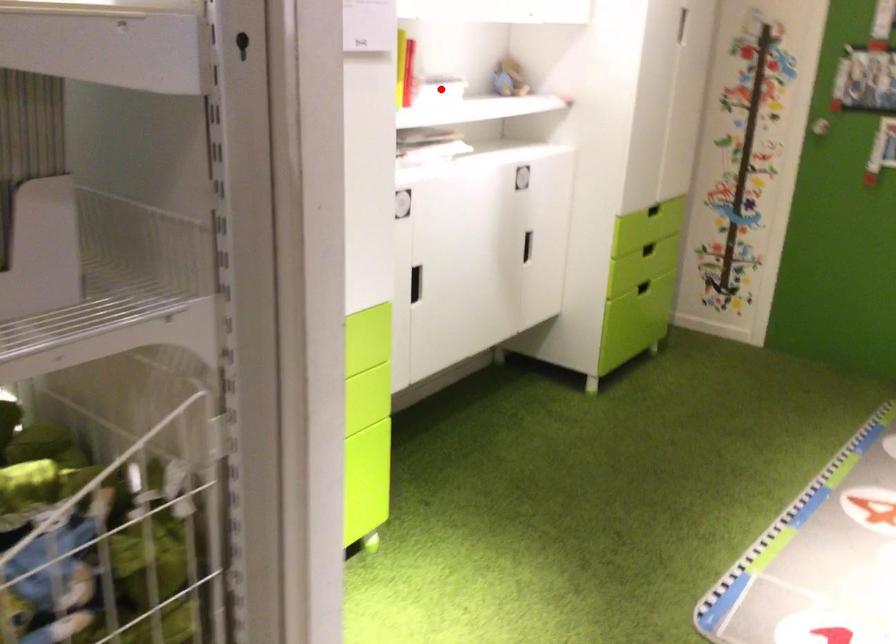
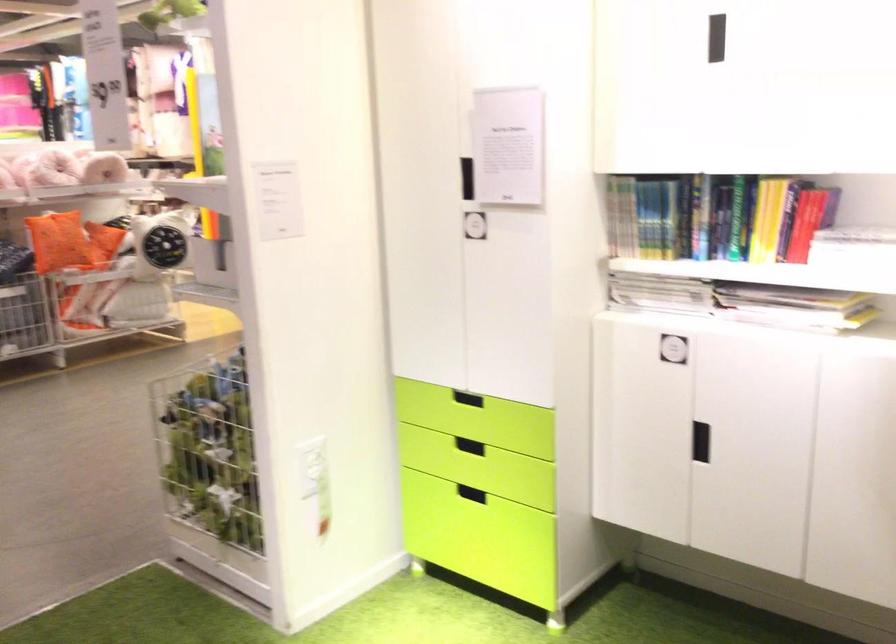
Question: I am providing you with two images of the same scene from different viewpoints. Given a red point in image1, look at the same physical point in image2. Is it:

Choices:
 (A) Closer to the viewpoint
 (B) Farther from the viewpoint

Answer: (A)